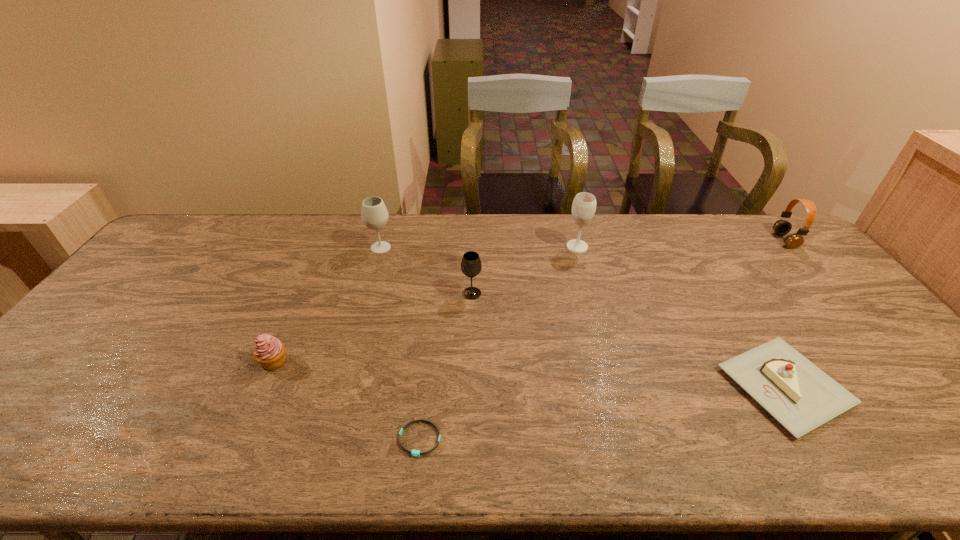
Locate an element on the screen. wristband is located at coordinates (415, 453).

This screenshot has height=540, width=960. Identify the location of free space located 0.370m on the left of the third object from right to left. (456, 247).

The image size is (960, 540). Identify the location of vacant area situated on the right of the leftmost wineglass. (408, 248).

At what (x,y) coordinates should I click in order to perform the action: click on vacant space situated 0.390m on the ear cups of the rightmost object. Please return your answer as a coordinate pair (x, y). The height and width of the screenshot is (540, 960). Looking at the image, I should click on (662, 240).

Locate an element on the screen. This screenshot has width=960, height=540. free location located on the ear cups of the rightmost object is located at coordinates (707, 240).

You are a GUI agent. You are given a task and a screenshot of the screen. Output one action in this format:
    pyautogui.click(x=<x>, y=<y>)
    Task: Click on the free space located 0.250m on the ear cups of the rightmost object
    This screenshot has width=960, height=540.
    Given the screenshot: What is the action you would take?
    pyautogui.click(x=704, y=240)

Where is `vacant space located 0.200m on the back of the fourth farthest object`? The width and height of the screenshot is (960, 540). vacant space located 0.200m on the back of the fourth farthest object is located at coordinates (472, 247).

Where is `vacant space situated 0.070m on the left of the leftmost object`? vacant space situated 0.070m on the left of the leftmost object is located at coordinates (231, 361).

Locate an element on the screen. vacant space situated on the left of the cake is located at coordinates (684, 387).

Identify the location of headset positioned at the far edge. This screenshot has width=960, height=540. (782, 227).